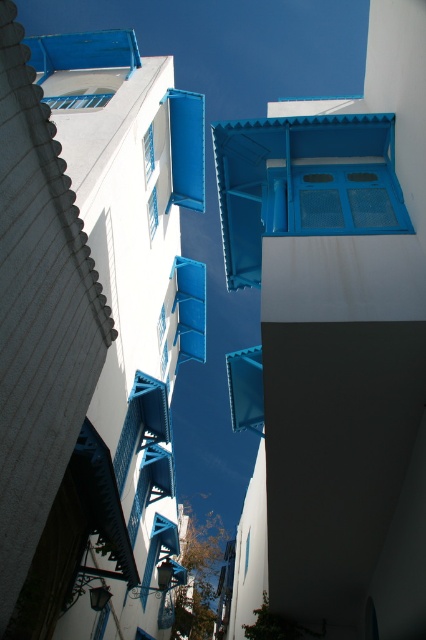
Who is positioned more to the right, blue matte window at center or blue matte window at upper left?

From the viewer's perspective, blue matte window at center appears more on the right side.

Between point (331, 182) and point (60, 99), which one is positioned in front?

Point (331, 182)

Is point (296, 230) behind point (66, 108)?

No, (296, 230) is closer to viewer.

You are a GUI agent. You are given a task and a screenshot of the screen. Output one action in this format:
    pyautogui.click(x=<x>, y=<y>)
    Task: Click on the blue matte window at center
    This screenshot has height=640, width=426.
    Given the screenshot: What is the action you would take?
    pyautogui.click(x=347, y=200)

Which is behind, point (325, 177) or point (155, 211)?

Positioned behind is point (155, 211).

What do you see at coordinates (347, 200) in the screenshot?
I see `blue matte window at center` at bounding box center [347, 200].

Locate an element on the screen. blue matte window at center is located at coordinates (347, 200).

Between blue matte window at center and blue matte window at upper center, which one has less height?

blue matte window at upper center is shorter.

Can you confirm if blue matte window at center is thinner than blue matte window at upper center?

In fact, blue matte window at center might be wider than blue matte window at upper center.

I want to click on blue matte window at center, so click(347, 200).

I want to click on blue matte window at center, so click(x=347, y=200).